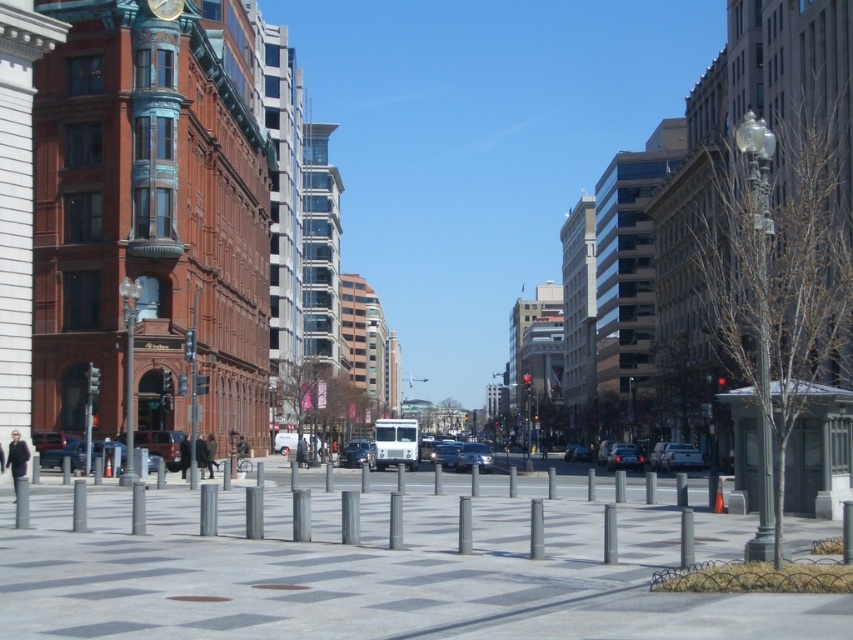
Between metallic streetlight at left and gold metallic clock at upper center, which one appears on the left side from the viewer's perspective?

From the viewer's perspective, gold metallic clock at upper center appears more on the left side.

Who is positioned more to the right, metallic streetlight at left or gold metallic clock at upper center?

metallic streetlight at left is more to the right.

What do you see at coordinates (192, 388) in the screenshot?
I see `metallic streetlight at left` at bounding box center [192, 388].

You are a GUI agent. You are given a task and a screenshot of the screen. Output one action in this format:
    pyautogui.click(x=<x>, y=<y>)
    Task: Click on the metallic streetlight at left
    This screenshot has height=640, width=853.
    Given the screenshot: What is the action you would take?
    pyautogui.click(x=192, y=388)

Can you confirm if matte black sedan at center is positioned below metallic streetlight at left?

Correct, matte black sedan at center is located below metallic streetlight at left.

Where is `matte black sedan at center`? This screenshot has height=640, width=853. matte black sedan at center is located at coordinates (65, 456).

This screenshot has height=640, width=853. Identify the location of matte black sedan at center. (65, 456).

Where is `matte black sedan at center`? The height and width of the screenshot is (640, 853). matte black sedan at center is located at coordinates (65, 456).

Based on the photo, which is above, silver metallic sedan at center or gold metallic clock at upper center?

Positioned higher is gold metallic clock at upper center.

Is silver metallic sedan at center thinner than gold metallic clock at upper center?

No, silver metallic sedan at center is not thinner than gold metallic clock at upper center.

Based on the photo, who is more forward, (x=648, y=464) or (x=173, y=8)?

Point (x=173, y=8)

In order to click on silver metallic sedan at center in this screenshot , I will do `click(675, 456)`.